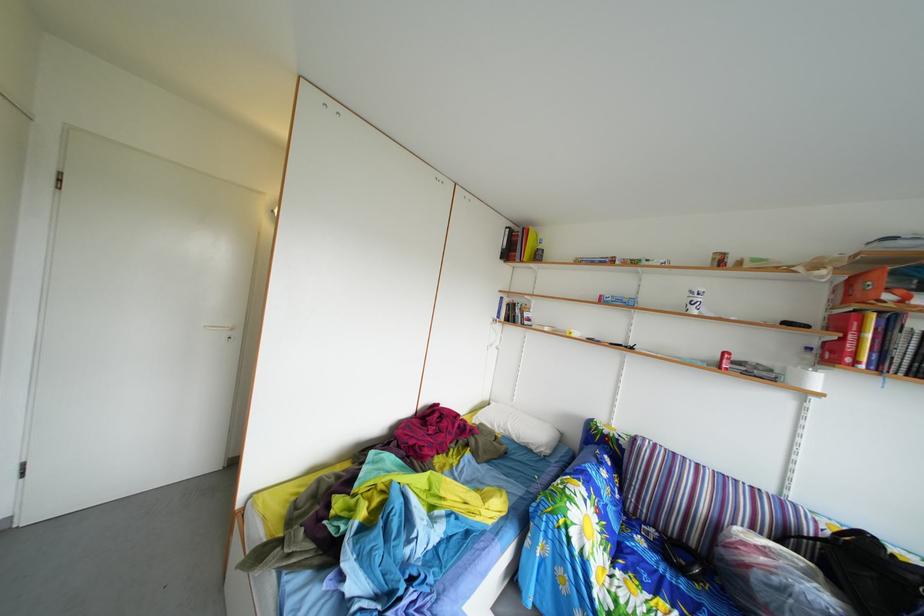
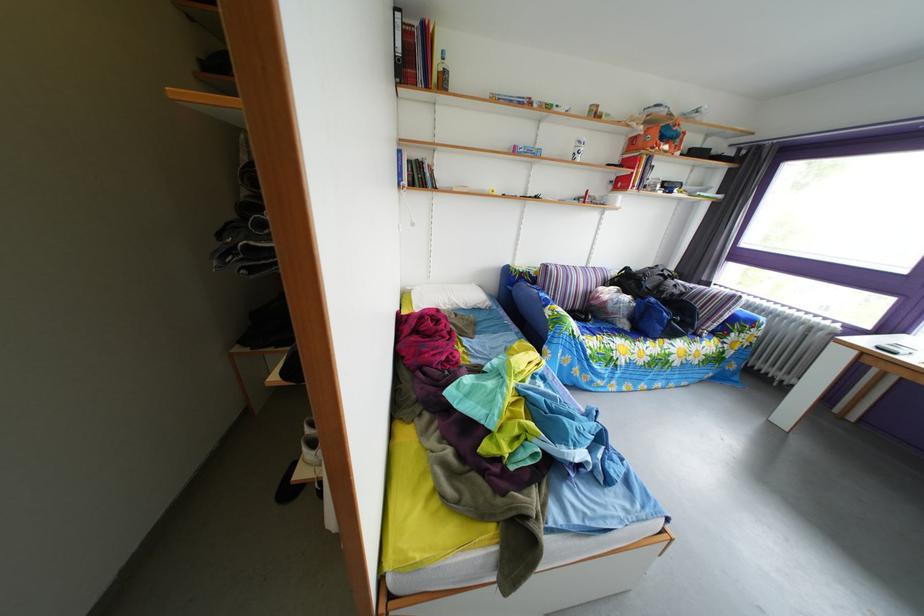
Where in the second image is the point corresponding to (869,573) from the first image?

(638, 289)